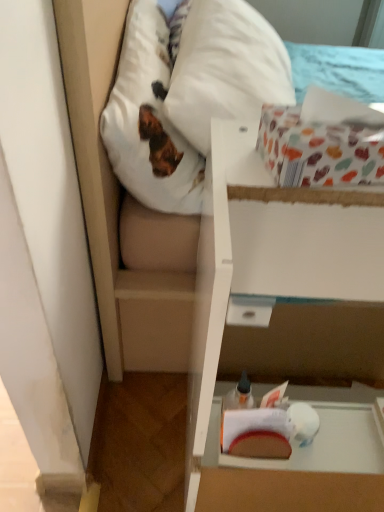
Question: From the image's perspective, is white cardboard box at center, which is the second cardboard box in top-to-bottom order, on white fabric mattress at upper center?

Choices:
 (A) yes
 (B) no

Answer: (B)

Question: From a real-world perspective, does white cardboard box at center, which ranks as the 1th cardboard box in bottom-to-top order, stand above white fabric mattress at upper center?

Choices:
 (A) yes
 (B) no

Answer: (B)

Question: Considering the relative sizes of white cardboard box at center, which ranks as the 1th cardboard box in bottom-to-top order, and white fabric mattress at upper center in the image provided, is white cardboard box at center, which ranks as the 1th cardboard box in bottom-to-top order, smaller than white fabric mattress at upper center?

Choices:
 (A) yes
 (B) no

Answer: (A)

Question: Does white cardboard box at center, which is the second cardboard box in top-to-bottom order, come in front of white fabric mattress at upper center?

Choices:
 (A) no
 (B) yes

Answer: (B)

Question: Is white fabric mattress at upper center a part of white cardboard box at center, which is the second cardboard box in top-to-bottom order?

Choices:
 (A) no
 (B) yes

Answer: (A)

Question: Based on their sizes in the image, would you say white soft pillow at upper left is bigger or smaller than white cardboard box at center, which ranks as the 1th cardboard box in bottom-to-top order?

Choices:
 (A) small
 (B) big

Answer: (A)

Question: From the image's perspective, is white soft pillow at upper left located above or below white cardboard box at center, which ranks as the 1th cardboard box in bottom-to-top order?

Choices:
 (A) above
 (B) below

Answer: (A)

Question: Based on their positions, is white soft pillow at upper left located to the left or right of white cardboard box at center, which is the second cardboard box in top-to-bottom order?

Choices:
 (A) right
 (B) left

Answer: (B)

Question: Does point (130, 41) appear closer or farther from the camera than point (211, 131)?

Choices:
 (A) closer
 (B) farther

Answer: (B)

Question: From the image's perspective, is white fabric mattress at upper center positioned above or below patterned paper box at upper right, the second cardboard box from the bottom?

Choices:
 (A) above
 (B) below

Answer: (A)

Question: In terms of height, does white fabric mattress at upper center look taller or shorter compared to patterned paper box at upper right, marked as the 1th cardboard box in a top-to-bottom arrangement?

Choices:
 (A) tall
 (B) short

Answer: (A)

Question: Relative to patterned paper box at upper right, the second cardboard box from the bottom, is white fabric mattress at upper center in front or behind?

Choices:
 (A) behind
 (B) front

Answer: (A)

Question: From a real-world perspective, relative to patterned paper box at upper right, the second cardboard box from the bottom, is white fabric mattress at upper center vertically above or below?

Choices:
 (A) above
 (B) below

Answer: (B)

Question: Based on their positions, is patterned paper box at upper right, marked as the 1th cardboard box in a top-to-bottom arrangement, located to the left or right of white soft pillow at upper left?

Choices:
 (A) right
 (B) left

Answer: (A)

Question: Considering the positions of patterned paper box at upper right, marked as the 1th cardboard box in a top-to-bottom arrangement, and white soft pillow at upper left in the image, is patterned paper box at upper right, marked as the 1th cardboard box in a top-to-bottom arrangement, wider or thinner than white soft pillow at upper left?

Choices:
 (A) thin
 (B) wide

Answer: (A)